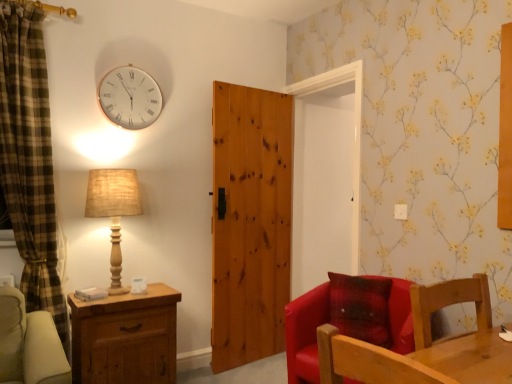
Find the location of a particular element. vacant space underneath burlap lampshade at left (from a real-world perspective) is located at coordinates (114, 288).